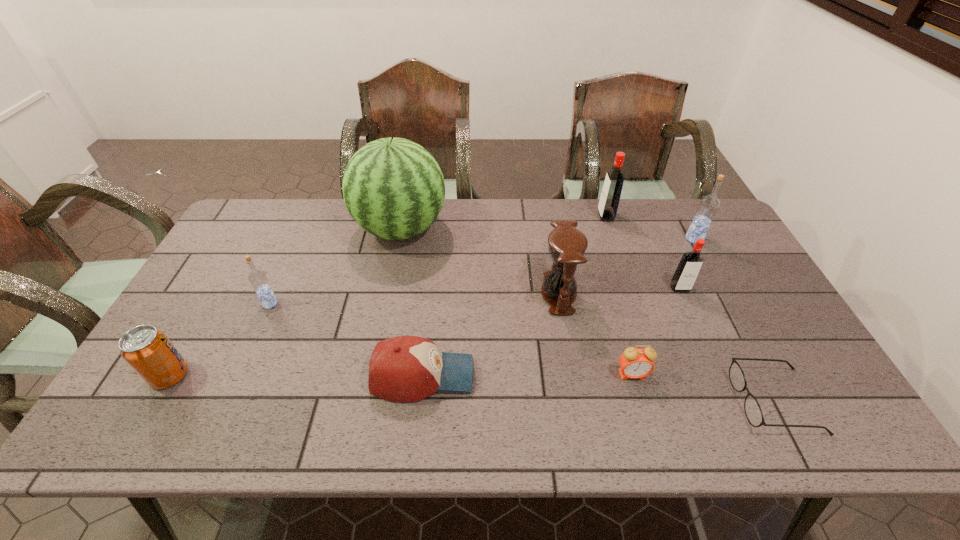
Where is `watermelon`? watermelon is located at coordinates (393, 188).

Find the location of a particular element. This screenshot has width=960, height=540. green watermelon is located at coordinates pos(393,188).

Image resolution: width=960 pixels, height=540 pixels. I want to click on the bigger red vodka, so click(609, 200).

Locate an element on the screen. The height and width of the screenshot is (540, 960). the left red vodka is located at coordinates (609, 200).

The width and height of the screenshot is (960, 540). Identify the location of the rightmost vodka. (708, 205).

Where is `the farther blue vodka`? This screenshot has width=960, height=540. the farther blue vodka is located at coordinates (708, 205).

In order to click on hourglass in this screenshot , I will do `click(567, 245)`.

Identify the location of the fifth object from left to right. (567, 245).

Image resolution: width=960 pixels, height=540 pixels. Find the location of `the right red vodka`. the right red vodka is located at coordinates (690, 264).

Identify the location of the third vodka from left to right. This screenshot has height=540, width=960. (690, 264).